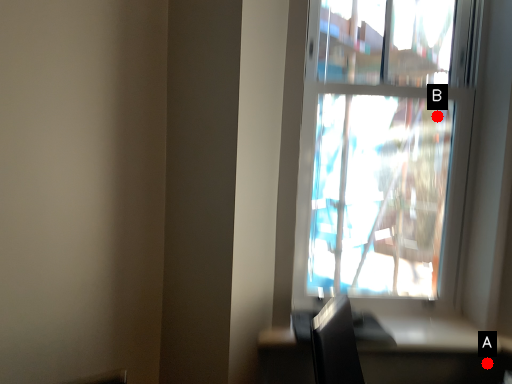
Question: Two points are circled on the image, labeled by A and B beside each circle. Which point is farther to the camera?

Choices:
 (A) A is further
 (B) B is further

Answer: (B)